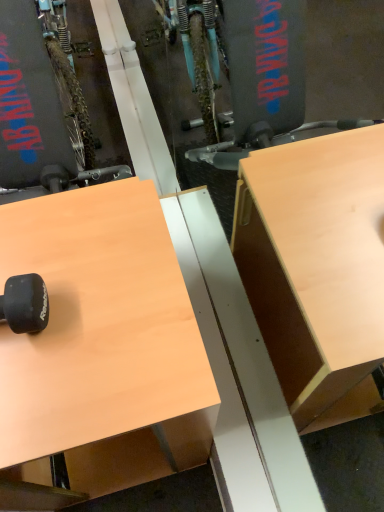
Locate an element on the screen. vacant space behind black rubber dumbbell at lower left is located at coordinates (37, 234).